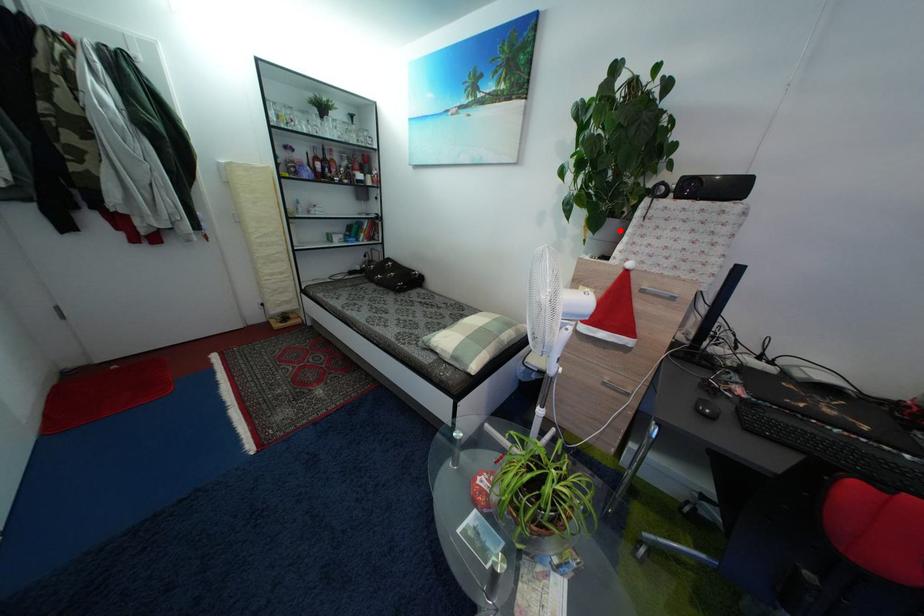
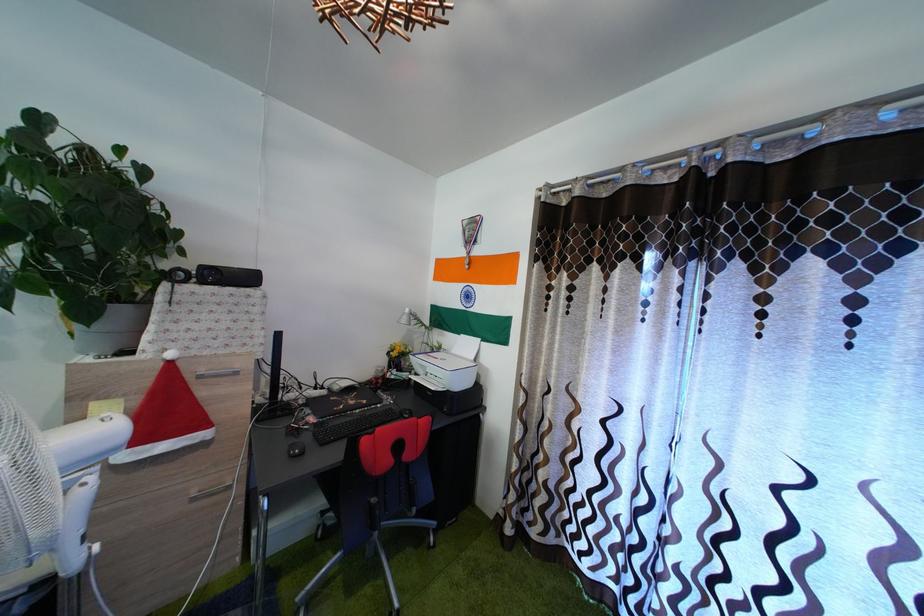
In the second image, find the point that corresponds to the highlighted location in the first image.

(128, 318)